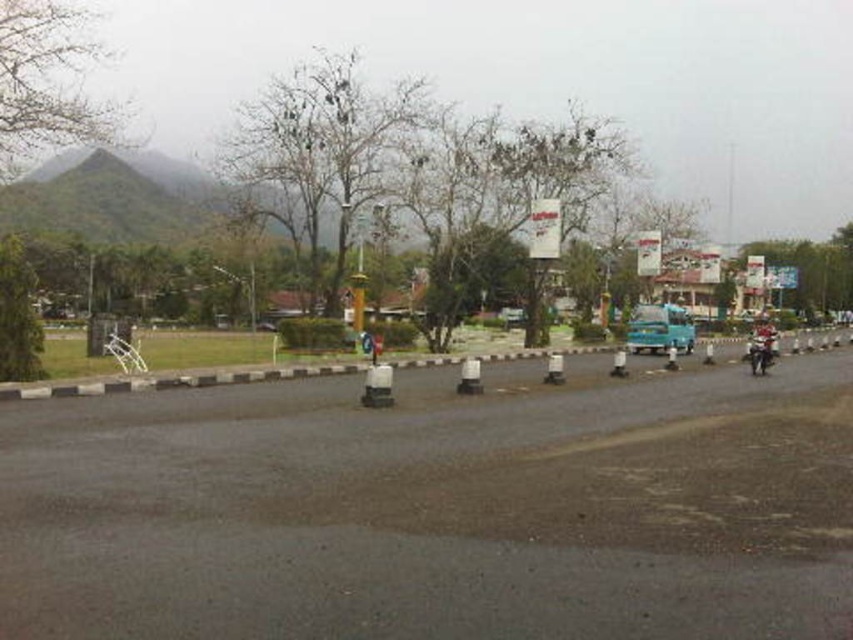
Can you confirm if blue matte truck at center is positioned to the left of shiny silver motorcycle at right?

Correct, you'll find blue matte truck at center to the left of shiny silver motorcycle at right.

Which is more to the left, blue matte truck at center or shiny silver motorcycle at right?

blue matte truck at center

Is point (631, 348) less distant than point (770, 355)?

No, (631, 348) is behind (770, 355).

Image resolution: width=853 pixels, height=640 pixels. What are the coordinates of `blue matte truck at center` in the screenshot? It's located at (659, 328).